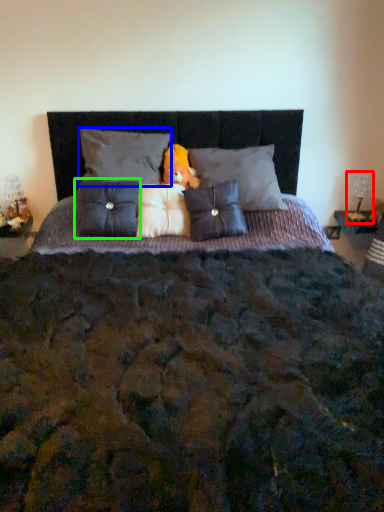
Question: Which object is the farthest from table lamp (highlighted by a red box)? Choose among these: pillow (highlighted by a blue box) or pillow (highlighted by a green box).

Choices:
 (A) pillow
 (B) pillow

Answer: (B)